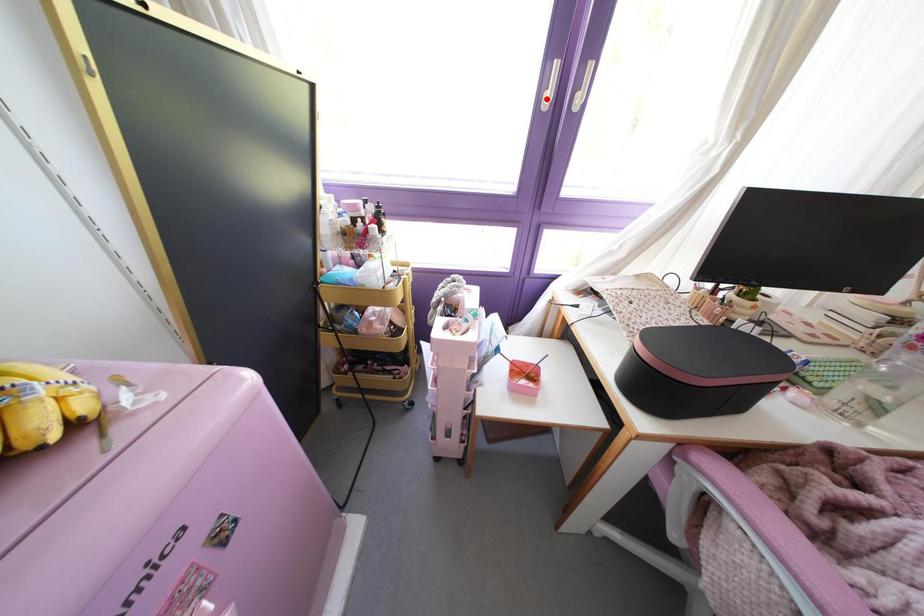
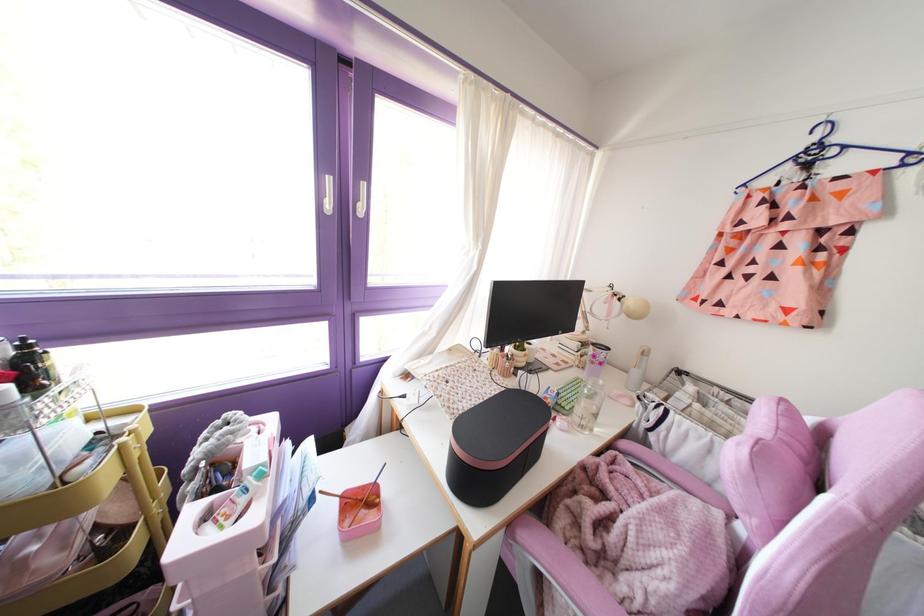
In the second image, find the point that corresponds to the highlighted location in the first image.

(329, 205)